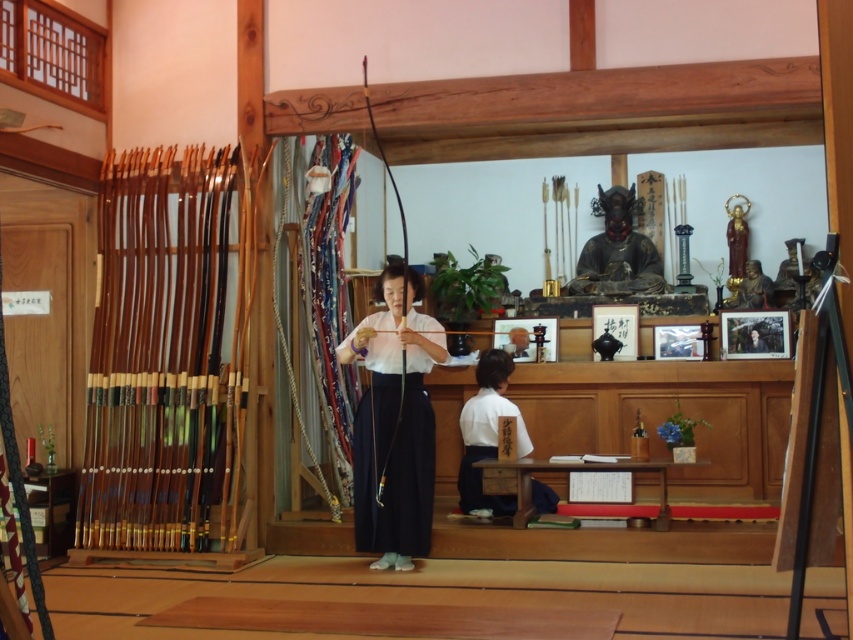
You are standing in the dojo and want to place a new decorative item between the black glossy statue at center and the gold statue at upper right. Based on their positions, where should you place the item to ensure it is between them?

The black glossy statue at center is in front of the gold statue at upper right, so placing the item between them would require positioning it in front of the gold statue at upper right but behind the black glossy statue at center.

You are an art curator planning to display the black glossy statue at center and the gold statue at upper right in a new exhibition. Considering their sizes, which statue should be placed on a lower pedestal to ensure proper visibility of both?

The black glossy statue at center is taller than the gold statue at upper right, so it should be placed on a lower pedestal to ensure proper visibility of both.

You are an archer in the scene and need to position yourself between the white cotton kimono at lower center and the matte gold statue at upper center. Which side of the statue should you stand on to be closer to the kimono?

To be closer to the white cotton kimono at lower center, you should stand to the left side of the matte gold statue at upper center since the kimono is positioned to the left of the statue.